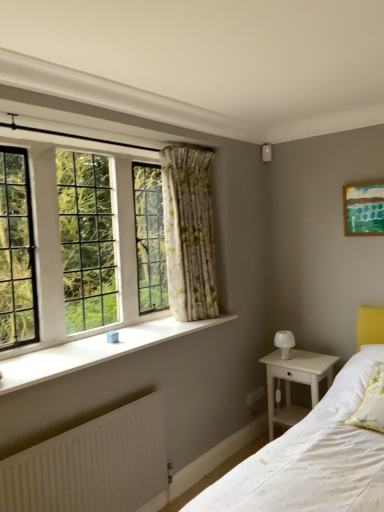
Question: Is white wood nightstand at lower right at the back of clear glass windows at upper left?

Choices:
 (A) no
 (B) yes

Answer: (A)

Question: Considering the relative sizes of clear glass windows at upper left and white wood nightstand at lower right in the image provided, is clear glass windows at upper left bigger than white wood nightstand at lower right?

Choices:
 (A) no
 (B) yes

Answer: (A)

Question: From a real-world perspective, is clear glass windows at upper left physically below white wood nightstand at lower right?

Choices:
 (A) yes
 (B) no

Answer: (B)

Question: Is the depth of clear glass windows at upper left less than that of white wood nightstand at lower right?

Choices:
 (A) yes
 (B) no

Answer: (A)

Question: Considering the relative positions of clear glass windows at upper left and white wood nightstand at lower right in the image provided, is clear glass windows at upper left to the right of white wood nightstand at lower right from the viewer's perspective?

Choices:
 (A) no
 (B) yes

Answer: (A)

Question: From a real-world perspective, is white wood nightstand at lower right physically located above or below clear glass windows at upper left?

Choices:
 (A) below
 (B) above

Answer: (A)

Question: In terms of size, does white wood nightstand at lower right appear bigger or smaller than clear glass windows at upper left?

Choices:
 (A) small
 (B) big

Answer: (B)

Question: Does point (317, 395) appear closer or farther from the camera than point (41, 135)?

Choices:
 (A) farther
 (B) closer

Answer: (A)

Question: Relative to clear glass windows at upper left, is white wood nightstand at lower right in front or behind?

Choices:
 (A) front
 (B) behind

Answer: (B)

Question: Is white textured radiator at lower left bigger or smaller than green textured canvas at upper right?

Choices:
 (A) small
 (B) big

Answer: (B)

Question: Considering the positions of white textured radiator at lower left and green textured canvas at upper right in the image, is white textured radiator at lower left taller or shorter than green textured canvas at upper right?

Choices:
 (A) short
 (B) tall

Answer: (B)

Question: Would you say white textured radiator at lower left is to the left or to the right of green textured canvas at upper right in the picture?

Choices:
 (A) right
 (B) left

Answer: (B)

Question: Relative to green textured canvas at upper right, is white textured radiator at lower left in front or behind?

Choices:
 (A) behind
 (B) front

Answer: (B)

Question: Is white textured radiator at lower left taller or shorter than white soft pillow at lower right?

Choices:
 (A) tall
 (B) short

Answer: (A)

Question: Is white textured radiator at lower left bigger or smaller than white soft pillow at lower right?

Choices:
 (A) small
 (B) big

Answer: (B)